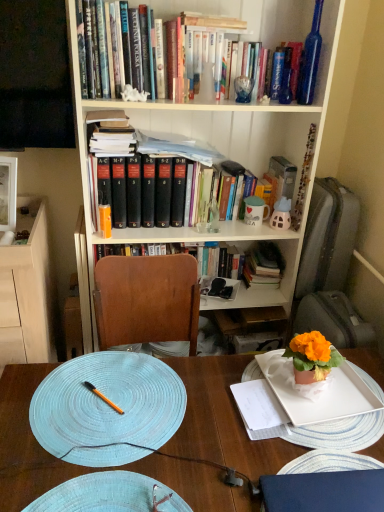
Image resolution: width=384 pixels, height=512 pixels. In order to click on vacant space situated above white matte plate at lower right, the third plate positioned from the left (from a real-world perspective) in this screenshot , I will do `click(313, 396)`.